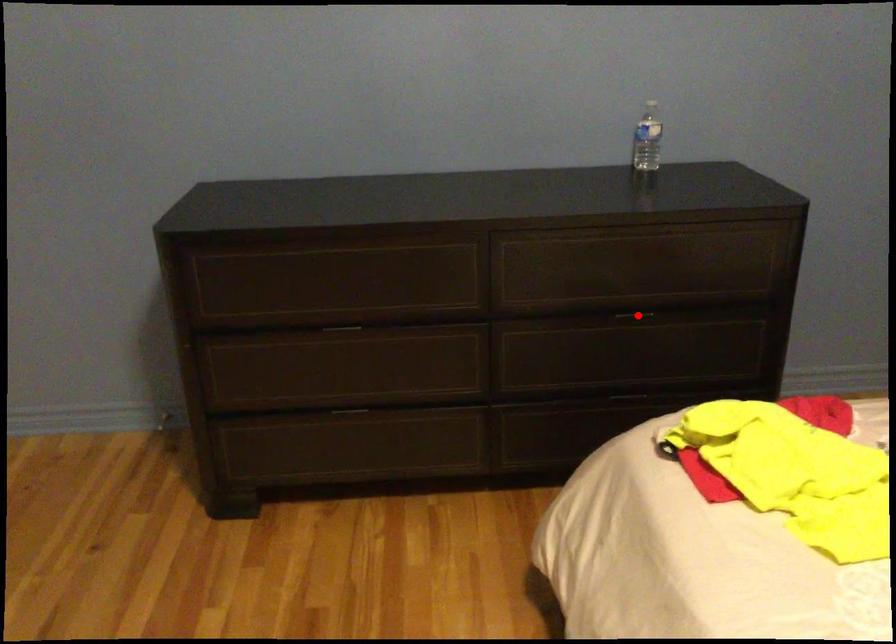
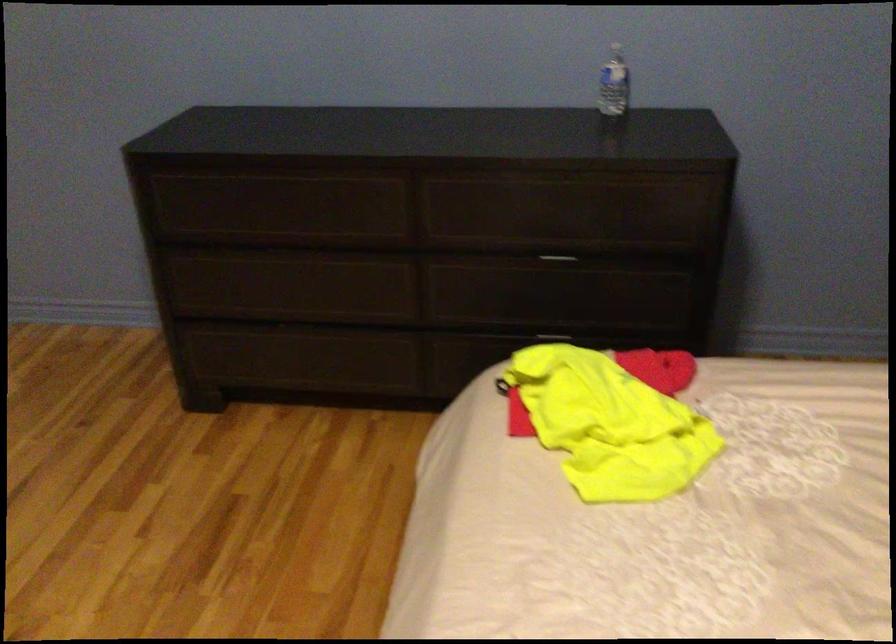
The point at the highlighted location is marked in the first image. Where is the corresponding point in the second image?

(557, 260)